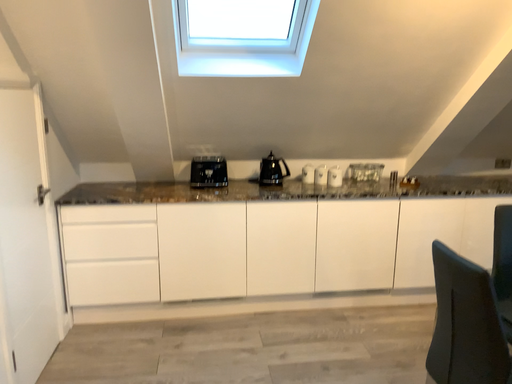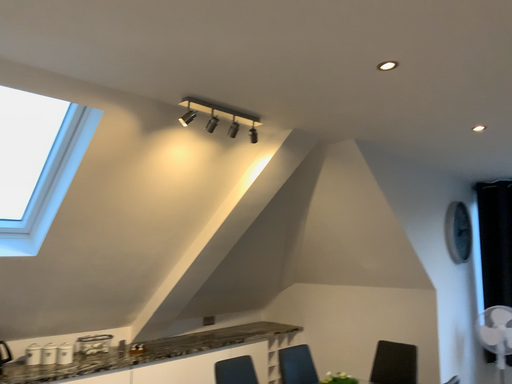
Question: Which way did the camera rotate in the video?

Choices:
 (A) rotated upward
 (B) rotated downward

Answer: (A)